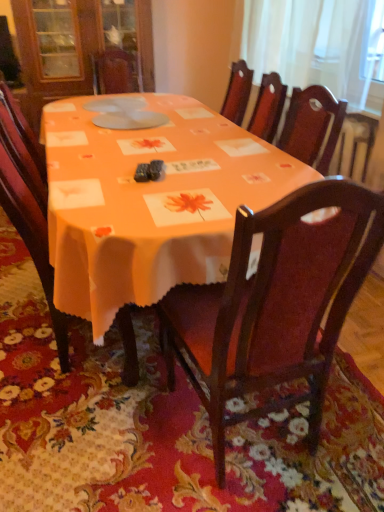
Locate an element on the screen. Image resolution: width=384 pixels, height=512 pixels. orange fabric table at center is located at coordinates (149, 199).

This screenshot has height=512, width=384. I want to click on orange fabric table at center, so click(149, 199).

Is wooden chair at center, the 2th chair viewed from the right, wider than orange fabric table at center?

Incorrect, the width of wooden chair at center, the 2th chair viewed from the right, does not surpass that of orange fabric table at center.

From a real-world perspective, is wooden chair at center, the 2th chair viewed from the right, positioned above or below orange fabric table at center?

Clearly, from a real-world perspective, wooden chair at center, the 2th chair viewed from the right, is above orange fabric table at center.

Would you say white sheer curtain at upper right is part of wooden chair at center, the 2th chair when ordered from left to right,'s contents?

No, white sheer curtain at upper right is not inside wooden chair at center, the 2th chair when ordered from left to right.

Which object is closer to the camera, wooden chair at center, the first chair when ordered from right to left, or white sheer curtain at upper right?

wooden chair at center, the first chair when ordered from right to left, is in front.

Does wooden chair at center, the first chair when ordered from right to left, have a smaller size compared to white sheer curtain at upper right?

No.

From the image's perspective, is wooden chair at center, the first chair when ordered from right to left, positioned above or below white sheer curtain at upper right?

Clearly, from the image's perspective, wooden chair at center, the first chair when ordered from right to left, is below white sheer curtain at upper right.

Image resolution: width=384 pixels, height=512 pixels. In order to click on chair to the left of wooden chair at center, the first chair when ordered from right to left in this screenshot , I will do `click(32, 241)`.

Is wooden chair at center, the first chair when ordered from right to left, far away from wooden chair at center, the 2th chair viewed from the right?

That's not correct — wooden chair at center, the first chair when ordered from right to left, is a little close to wooden chair at center, the 2th chair viewed from the right.

What's the angular difference between wooden chair at center, the first chair when ordered from right to left, and wooden chair at center, the 2th chair viewed from the right,'s facing directions?

There is a 90-degree angle between the facing directions of wooden chair at center, the first chair when ordered from right to left, and wooden chair at center, the 2th chair viewed from the right.

From a real-world perspective, which is physically below, wooden chair at center, marked as the 1th chair in a left-to-right arrangement, or white sheer curtain at upper right?

From a 3D spatial view, wooden chair at center, marked as the 1th chair in a left-to-right arrangement, is below.

Is wooden chair at center, the 2th chair viewed from the right, thinner than white sheer curtain at upper right?

No, wooden chair at center, the 2th chair viewed from the right, is not thinner than white sheer curtain at upper right.

Is point (49, 292) farther from viewer compared to point (355, 25)?

No, (49, 292) is in front of (355, 25).

Can you confirm if wooden chair at center, the 2th chair viewed from the right, is positioned to the right of white sheer curtain at upper right?

In fact, wooden chair at center, the 2th chair viewed from the right, is to the left of white sheer curtain at upper right.

Looking at this image, is wooden chair at center, the 2th chair when ordered from left to right, positioned with its back to orange fabric table at center?

Yes, orange fabric table at center is at the back of wooden chair at center, the 2th chair when ordered from left to right.

Considering their positions, is wooden chair at center, the 2th chair when ordered from left to right, located in front of or behind orange fabric table at center?

Visually, wooden chair at center, the 2th chair when ordered from left to right, is located in front of orange fabric table at center.

Does wooden chair at center, the 2th chair when ordered from left to right, have a larger size compared to orange fabric table at center?

Incorrect, wooden chair at center, the 2th chair when ordered from left to right, is not larger than orange fabric table at center.

From the picture: Would you say wooden chair at center, the first chair when ordered from right to left, contains orange fabric table at center?

No, orange fabric table at center is located outside of wooden chair at center, the first chair when ordered from right to left.

Locate an element on the screen. table above the wooden chair at center, the 2th chair viewed from the right (from the image's perspective) is located at coordinates (149, 199).

Between orange fabric table at center and wooden chair at center, marked as the 1th chair in a left-to-right arrangement, which one has smaller size?

Smaller between the two is wooden chair at center, marked as the 1th chair in a left-to-right arrangement.

Based on the photo, is orange fabric table at center inside the boundaries of wooden chair at center, the 2th chair viewed from the right, or outside?

orange fabric table at center is outside wooden chair at center, the 2th chair viewed from the right.

From a real-world perspective, which object rests below the other?

From a 3D spatial view, orange fabric table at center is below.

Is point (23, 212) farther from viewer compared to point (311, 395)?

Yes, point (23, 212) is farther from viewer.

How many degrees apart are the facing directions of wooden chair at center, the 2th chair viewed from the right, and wooden chair at center, the first chair when ordered from right to left?

90 degrees.

From a real-world perspective, which object stands above the other?

In real-world perspective, wooden chair at center, the 2th chair when ordered from left to right, is above.

Consider the image. Measure the distance between wooden chair at center, the 2th chair viewed from the right, and wooden chair at center, the first chair when ordered from right to left.

A distance of 28.13 inches exists between wooden chair at center, the 2th chair viewed from the right, and wooden chair at center, the first chair when ordered from right to left.

Where is `chair behind the orange fabric table at center`? chair behind the orange fabric table at center is located at coordinates (32, 241).

In order to click on the 2nd chair positioned below the white sheer curtain at upper right (from the image's perspective) in this screenshot , I will do `click(275, 304)`.

Looking at the image, which one is located closer to orange fabric table at center, wooden chair at center, the 2th chair viewed from the right, or white sheer curtain at upper right?

wooden chair at center, the 2th chair viewed from the right, lies closer to orange fabric table at center than the other object.

When comparing their distances from wooden chair at center, the 2th chair when ordered from left to right, does orange fabric table at center or wooden chair at center, marked as the 1th chair in a left-to-right arrangement, seem further?

wooden chair at center, marked as the 1th chair in a left-to-right arrangement, is further to wooden chair at center, the 2th chair when ordered from left to right.

Looking at the image, which one is located closer to white sheer curtain at upper right, wooden chair at center, the 2th chair viewed from the right, or orange fabric table at center?

Among the two, orange fabric table at center is located nearer to white sheer curtain at upper right.

Based on their spatial positions, is white sheer curtain at upper right or wooden chair at center, the 2th chair viewed from the right, closer to orange fabric table at center?

wooden chair at center, the 2th chair viewed from the right, is positioned closer to the anchor orange fabric table at center.

Which object lies nearer to the anchor point white sheer curtain at upper right, wooden chair at center, the 2th chair when ordered from left to right, or wooden chair at center, the 2th chair viewed from the right?

wooden chair at center, the 2th chair when ordered from left to right, lies closer to white sheer curtain at upper right than the other object.

Considering their positions, is orange fabric table at center positioned closer to white sheer curtain at upper right than wooden chair at center, the 2th chair when ordered from left to right?

orange fabric table at center lies closer to white sheer curtain at upper right than the other object.

Based on their spatial positions, is wooden chair at center, the 2th chair when ordered from left to right, or white sheer curtain at upper right further from orange fabric table at center?

white sheer curtain at upper right lies further to orange fabric table at center than the other object.

From the image, which object appears to be nearer to wooden chair at center, the first chair when ordered from right to left, orange fabric table at center or white sheer curtain at upper right?

Based on the image, orange fabric table at center appears to be nearer to wooden chair at center, the first chair when ordered from right to left.

In order to click on table between wooden chair at center, marked as the 1th chair in a left-to-right arrangement, and wooden chair at center, the 2th chair when ordered from left to right, from left to right in this screenshot , I will do `click(149, 199)`.

The height and width of the screenshot is (512, 384). I want to click on table that lies between white sheer curtain at upper right and wooden chair at center, the 2th chair when ordered from left to right, from top to bottom, so click(149, 199).

This screenshot has height=512, width=384. Identify the location of chair between white sheer curtain at upper right and wooden chair at center, the 2th chair when ordered from left to right, in the up-down direction. (32, 241).

Image resolution: width=384 pixels, height=512 pixels. What are the coordinates of `table that lies between white sheer curtain at upper right and wooden chair at center, marked as the 1th chair in a left-to-right arrangement, from top to bottom` in the screenshot? It's located at (149, 199).